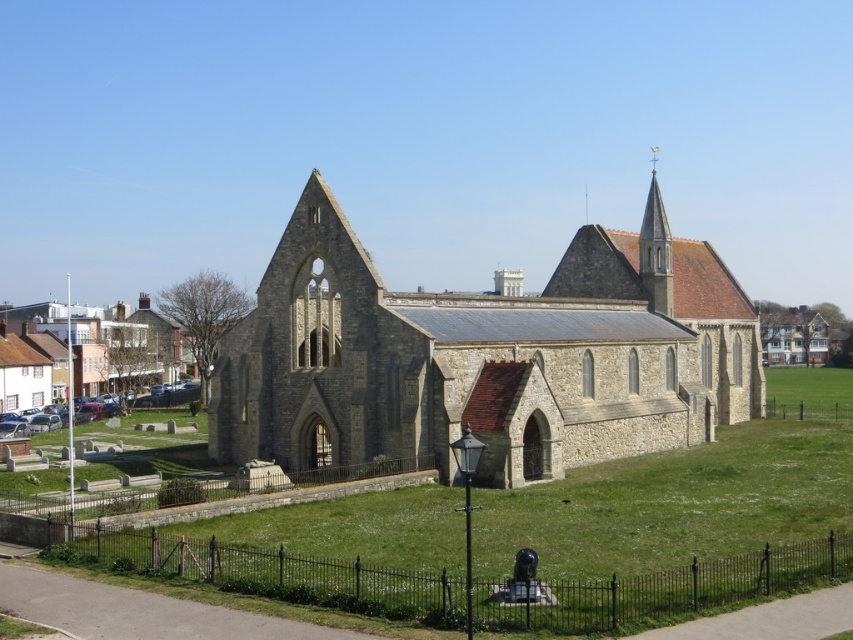
Question: Which point is farther to the camera?

Choices:
 (A) (653, 275)
 (B) (521, 438)

Answer: (A)

Question: Does stone church at center appear over smooth stone spire at upper right?

Choices:
 (A) yes
 (B) no

Answer: (B)

Question: Is stone church at center positioned at the back of smooth stone spire at upper right?

Choices:
 (A) yes
 (B) no

Answer: (B)

Question: Which point is closer to the camera taking this photo?

Choices:
 (A) (650, 214)
 (B) (418, 349)

Answer: (B)

Question: Among these points, which one is farthest from the camera?

Choices:
 (A) (648, 256)
 (B) (482, 396)

Answer: (A)

Question: Is stone church at center to the left of smooth stone spire at upper right from the viewer's perspective?

Choices:
 (A) no
 (B) yes

Answer: (B)